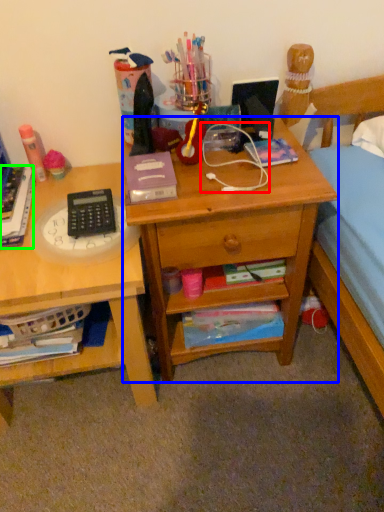
Question: Estimate the real-world distances between objects in this image. Which object is closer to twin (highlighted by a red box), desk (highlighted by a blue box) or book (highlighted by a green box)?

Choices:
 (A) desk
 (B) book

Answer: (A)